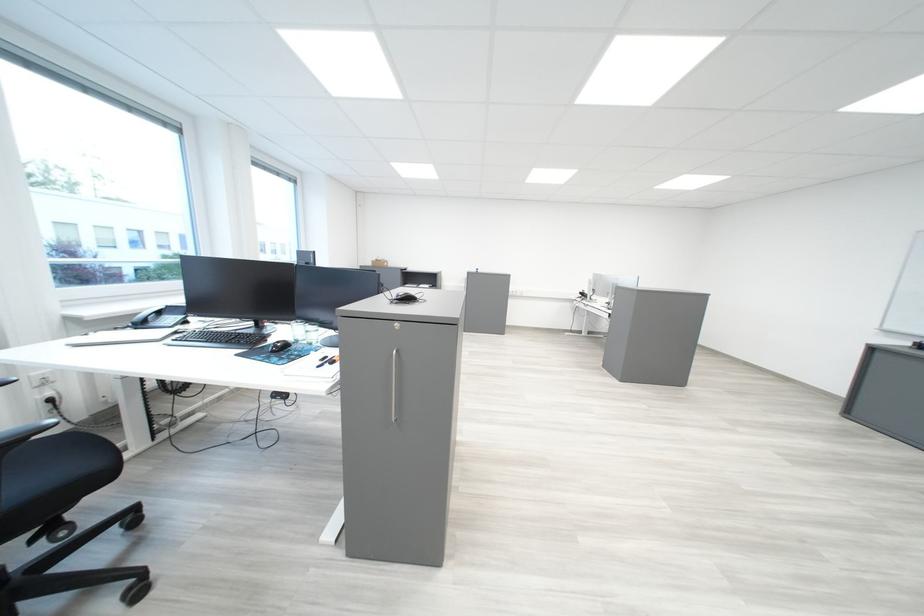
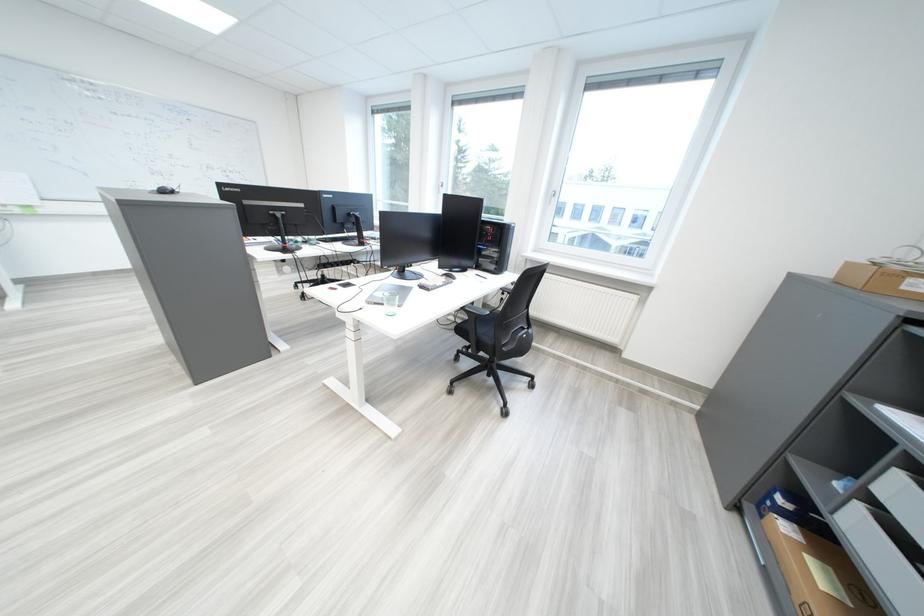
Find the pixel in the second image that matches point 383,265 in the first image.

(839, 274)